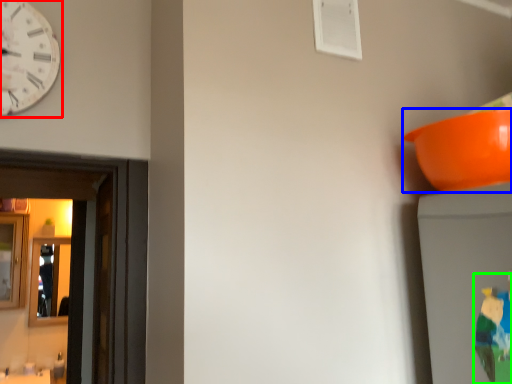
Question: Which object is positioned farthest from wall clock (highlighted by a red box)? Select from bowl (highlighted by a blue box) and toy (highlighted by a green box).

Choices:
 (A) bowl
 (B) toy

Answer: (B)